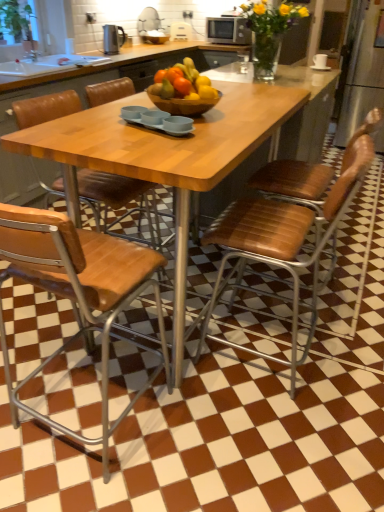
Question: Is matte silver microwave at upper center, which is the first appliance in right-to-left order, with black plastic kettle at upper left, which is the 1th appliance in bottom-to-top order?

Choices:
 (A) yes
 (B) no

Answer: (B)

Question: Could you tell me if matte silver microwave at upper center, which is the 2th appliance in bottom-to-top order, is facing black plastic kettle at upper left, positioned as the 1th appliance in front-to-back order?

Choices:
 (A) no
 (B) yes

Answer: (B)

Question: Is matte silver microwave at upper center, which is the 1th appliance in back-to-front order, to the left of black plastic kettle at upper left, positioned as the 1th appliance in front-to-back order, from the viewer's perspective?

Choices:
 (A) yes
 (B) no

Answer: (B)

Question: Is matte silver microwave at upper center, which is the 1th appliance in back-to-front order, outside black plastic kettle at upper left, which is counted as the first appliance, starting from the left?

Choices:
 (A) no
 (B) yes

Answer: (B)

Question: From a real-world perspective, is matte silver microwave at upper center, which is the first appliance in right-to-left order, over black plastic kettle at upper left, positioned as the 1th appliance in front-to-back order?

Choices:
 (A) yes
 (B) no

Answer: (A)

Question: Is matte silver microwave at upper center, which appears as the 2th appliance when viewed from the front, positioned in front of black plastic kettle at upper left, which is the 2th appliance in top-to-bottom order?

Choices:
 (A) yes
 (B) no

Answer: (B)

Question: Does black plastic kettle at upper left, the 2th appliance viewed from the right, have a greater width compared to translucent glass vase at upper center?

Choices:
 (A) yes
 (B) no

Answer: (B)

Question: Is black plastic kettle at upper left, placed as the second appliance when sorted from back to front, behind translucent glass vase at upper center?

Choices:
 (A) no
 (B) yes

Answer: (B)

Question: Can you confirm if black plastic kettle at upper left, positioned as the 1th appliance in front-to-back order, is bigger than translucent glass vase at upper center?

Choices:
 (A) yes
 (B) no

Answer: (B)

Question: Is black plastic kettle at upper left, the 2th appliance viewed from the right, far away from translucent glass vase at upper center?

Choices:
 (A) yes
 (B) no

Answer: (A)

Question: Is black plastic kettle at upper left, placed as the second appliance when sorted from back to front, at the left side of translucent glass vase at upper center?

Choices:
 (A) no
 (B) yes

Answer: (B)

Question: Considering the relative positions of black plastic kettle at upper left, placed as the second appliance when sorted from back to front, and translucent glass vase at upper center in the image provided, is black plastic kettle at upper left, placed as the second appliance when sorted from back to front, to the right of translucent glass vase at upper center from the viewer's perspective?

Choices:
 (A) no
 (B) yes

Answer: (A)

Question: Is wooden bowl at center looking in the opposite direction of wooden at center, marked as the second chair in a left-to-right arrangement?

Choices:
 (A) no
 (B) yes

Answer: (A)